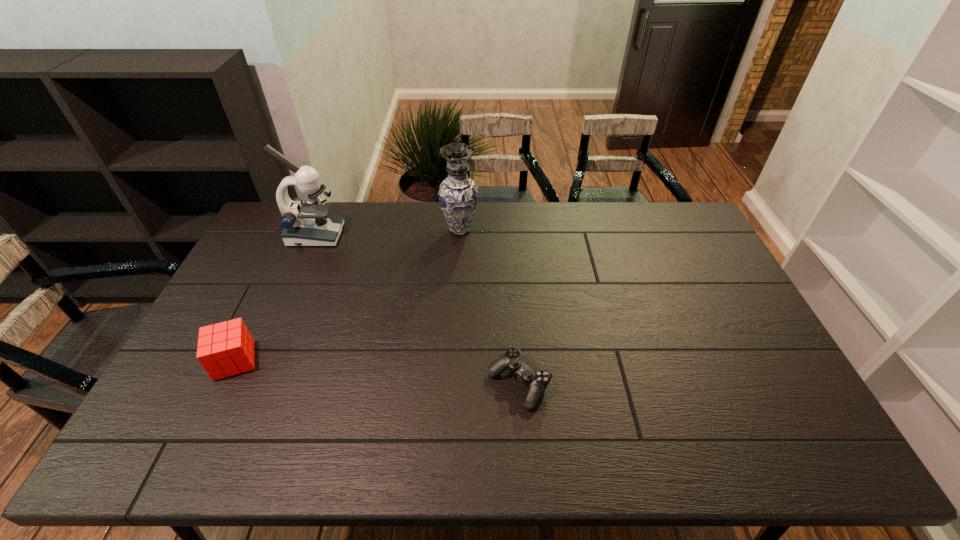
The height and width of the screenshot is (540, 960). In order to click on empty location between the cube and the microscope in this screenshot , I will do `click(275, 298)`.

The width and height of the screenshot is (960, 540). Identify the location of vacant point located between the shortest object and the vase. [490, 307].

At what (x,y) coordinates should I click in order to perform the action: click on free space between the cube and the shortest object. Please return your answer as a coordinate pair (x, y). This screenshot has width=960, height=540. Looking at the image, I should click on (376, 372).

Find the location of a particular element. vacant region between the second shortest object and the vase is located at coordinates (348, 295).

This screenshot has width=960, height=540. Find the location of `free spot between the vase and the shortest object`. free spot between the vase and the shortest object is located at coordinates (490, 307).

Locate an element on the screen. free space between the third object from left to right and the microscope is located at coordinates (388, 233).

Locate an element on the screen. free space that is in between the second object from right to left and the second shortest object is located at coordinates (348, 295).

The width and height of the screenshot is (960, 540). I want to click on free spot between the shortest object and the cube, so click(x=376, y=372).

At what (x,y) coordinates should I click in order to perform the action: click on object that is the closest to the vase. Please return your answer as a coordinate pair (x, y). Looking at the image, I should click on (x=305, y=223).

Locate which object ranks third in proximity to the third tallest object. Please provide its 2D coordinates. Your answer should be formatted as a tuple, i.e. [(x, y)], where the tuple contains the x and y coordinates of a point satisfying the conditions above.

[(458, 194)]